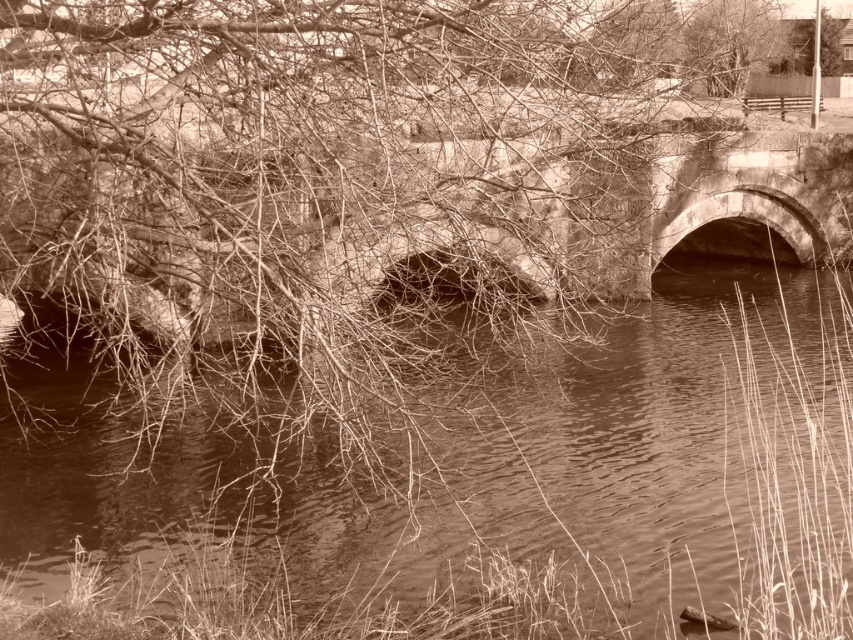
Question: Which of the following is the farthest from the observer?

Choices:
 (A) (492, 420)
 (B) (631, 154)
 (C) (711, 67)

Answer: (C)

Question: Which of the following is the closest to the observer?

Choices:
 (A) (811, 372)
 (B) (686, 209)
 (C) (728, 4)

Answer: (A)

Question: Is brown water at center wider than bare branches at upper center?

Choices:
 (A) yes
 (B) no

Answer: (A)

Question: Which of the following is the farthest from the observer?

Choices:
 (A) bare branches at upper center
 (B) brown water at center
 (C) stone bridge at center

Answer: (A)

Question: Can you confirm if brown water at center is positioned below stone bridge at center?

Choices:
 (A) no
 (B) yes

Answer: (B)

Question: Does brown water at center appear under stone bridge at center?

Choices:
 (A) yes
 (B) no

Answer: (A)